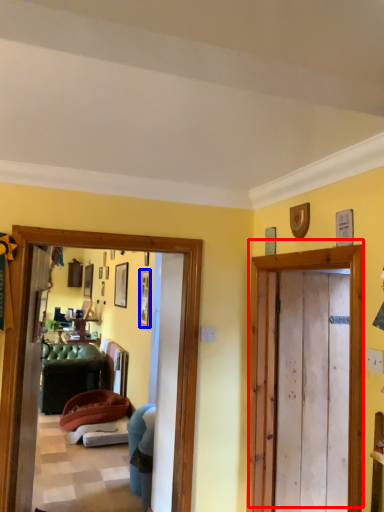
Question: Among these objects, which one is nearest to the camera, door (highlighted by a red box) or picture frame (highlighted by a blue box)?

Choices:
 (A) door
 (B) picture frame

Answer: (A)